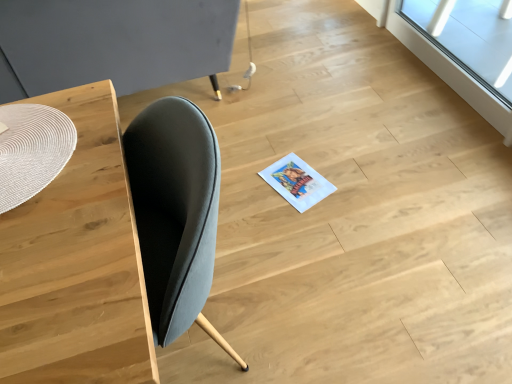
Where is `free area below transparent glass window at upper right (from a real-world perspective)`? The width and height of the screenshot is (512, 384). free area below transparent glass window at upper right (from a real-world perspective) is located at coordinates (442, 76).